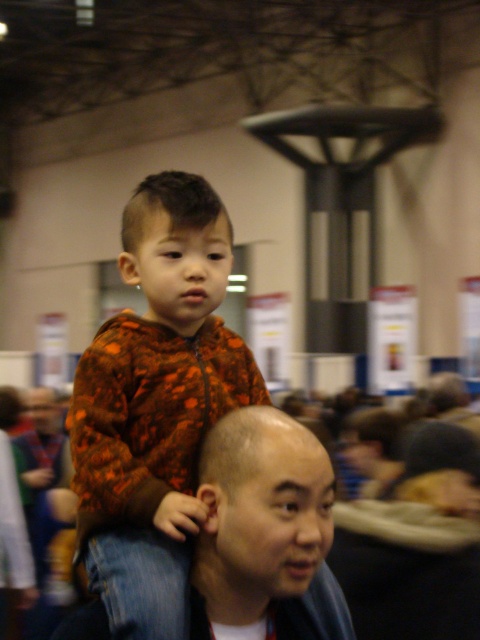
Can you confirm if orange printed shirt at upper left is taller than smooth brown hair at upper center?

Indeed, orange printed shirt at upper left has a greater height compared to smooth brown hair at upper center.

Between orange printed shirt at upper left and smooth brown hair at upper center, which one appears on the left side from the viewer's perspective?

orange printed shirt at upper left is more to the left.

Is point (305, 509) in front of point (452, 388)?

Yes, point (305, 509) is closer to viewer.

In order to click on orange printed shirt at upper left in this screenshot , I will do `click(261, 509)`.

Measure the distance between smooth brown hair at upper center and camera.

smooth brown hair at upper center and camera are 8.90 meters apart from each other.

Can you confirm if smooth brown hair at upper center is smaller than matte black head at upper center?

Incorrect, smooth brown hair at upper center is not smaller in size than matte black head at upper center.

Who is more distant from viewer, (459, 384) or (44, 403)?

The point (459, 384) is behind.

Locate an element on the screen. This screenshot has height=640, width=480. smooth brown hair at upper center is located at coordinates (444, 394).

Who is more forward, (300, 548) or (96, 472)?

Positioned in front is point (300, 548).

Can you confirm if orange printed shirt at upper left is bigger than orange fleece jacket at upper center?

No.

The height and width of the screenshot is (640, 480). In order to click on orange printed shirt at upper left in this screenshot , I will do `click(261, 509)`.